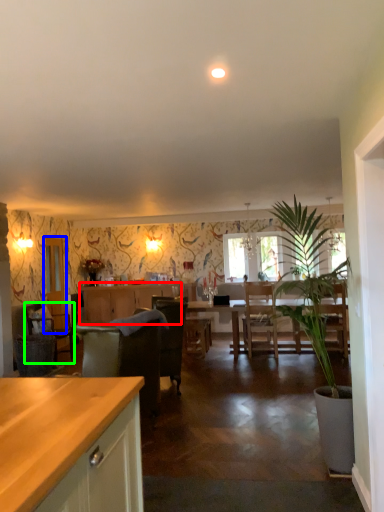
Question: Which object is positioned closest to cabinetry (highlighted by a red box)? Select from glass door (highlighted by a blue box) and chair (highlighted by a green box).

Choices:
 (A) glass door
 (B) chair

Answer: (A)